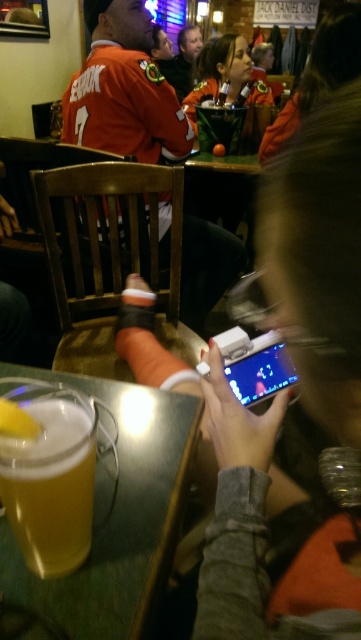
You are a customer at the sports bar and want to hang your orange jersey at upper left and matte black jacket at center on the coat rack behind you. However, the coat rack is only large enough to hold one item. Based on their current positions, which item is closer to the coat rack and should be moved first?

The orange jersey at upper left is closer to the coat rack than the matte black jacket at center, so you should move the orange jersey at upper left first to make space for the matte black jacket at center.

You are at the sports bar and want to place a small coaster between the two points, point (124, 67) and point (45, 534). Based on their positions, which point is closer to you where you should place the coaster first?

Point (124, 67) is closer to you than point (45, 534), so you should place the coaster near point (124, 67) first.

Based on the photo, you are a bartender at the sports bar. You need to place a new menu board on the wall between the orange jersey at upper left and the golden frothy beer at lower left. Which object should you position closer to the menu board to ensure it doesn

The orange jersey at upper left is wider than the golden frothy beer at lower left, so positioning the menu board closer to the orange jersey at upper left would provide a better visual balance due to its larger size.